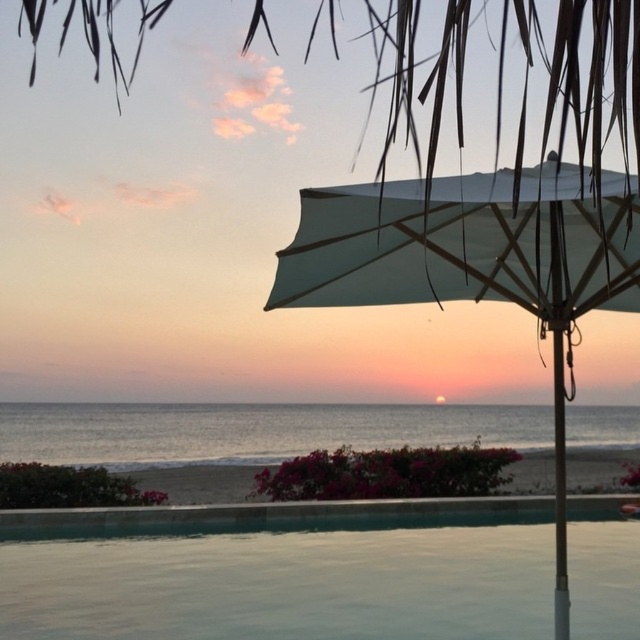
You are standing at the edge of the smooth glass pool at lower center. Which direction should you walk to reach the ocean?

The smooth glass pool at lower center is located at point (x=284, y=572). Since the pool is in the foreground and the ocean is in the mid to background, you should walk forward to reach the ocean.

You are standing on the beach and want to take a photo of the smooth glass pool at lower center and the white fabric umbrella at right. Which object should you point your camera towards first if you want to capture both in the same frame without moving your position?

You should point your camera towards the smooth glass pool at lower center first because it is located below the white fabric umbrella at right, allowing both to be captured in the frame when aiming downward from the umbrella.